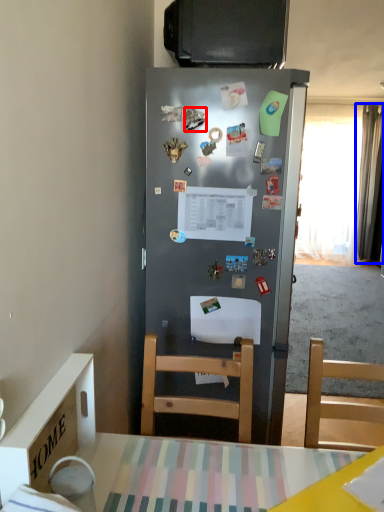
Question: Which of the following is the closest to the observer, magnet (highlighted by a red box) or curtain (highlighted by a blue box)?

Choices:
 (A) magnet
 (B) curtain

Answer: (A)